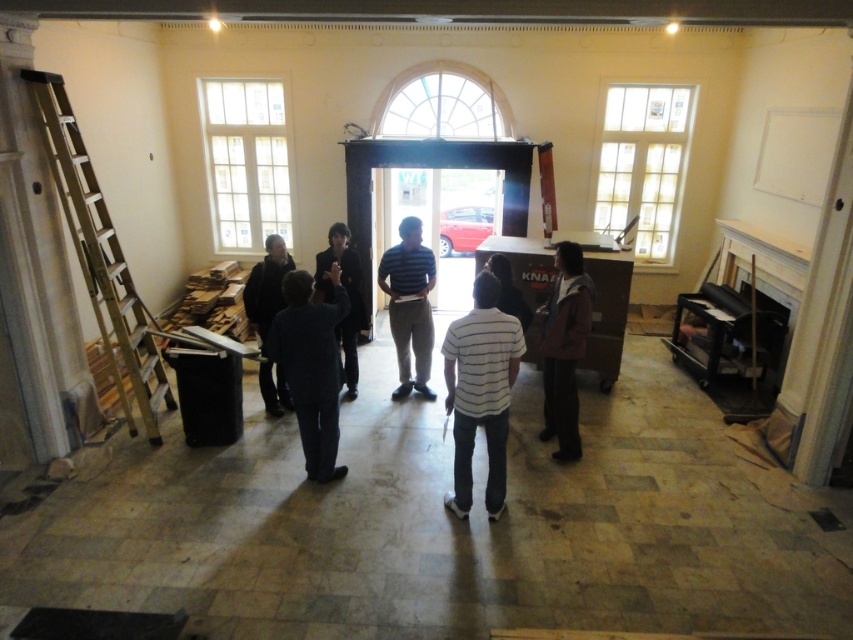
You are a delivery person carrying a box that is 18 inches wide. You need to pass between the striped fabric shirt at center and the dark brown leather jacket at center. Do you think you can fit through the space between them?

The distance between the striped fabric shirt at center and the dark brown leather jacket at center is 17.56 inches. Since the box is 18 inches wide, it is slightly wider than the available space. Therefore, you cannot fit through the space between them.

You are standing at the point marked as point (421, 314) in a room with a camera placed somewhere. If the distance between you and the camera is 6.01 meters, can you estimate how far you are from the camera?

The distance between point (421, 314) and the camera is exactly 6.01 meters, so you are 6.01 meters away from the camera.